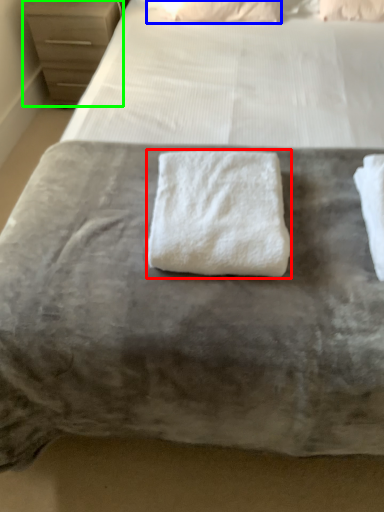
Question: Considering the real-world distances, which object is closest to towel (highlighted by a red box)? pillow (highlighted by a blue box) or chest of drawers (highlighted by a green box).

Choices:
 (A) pillow
 (B) chest of drawers

Answer: (A)